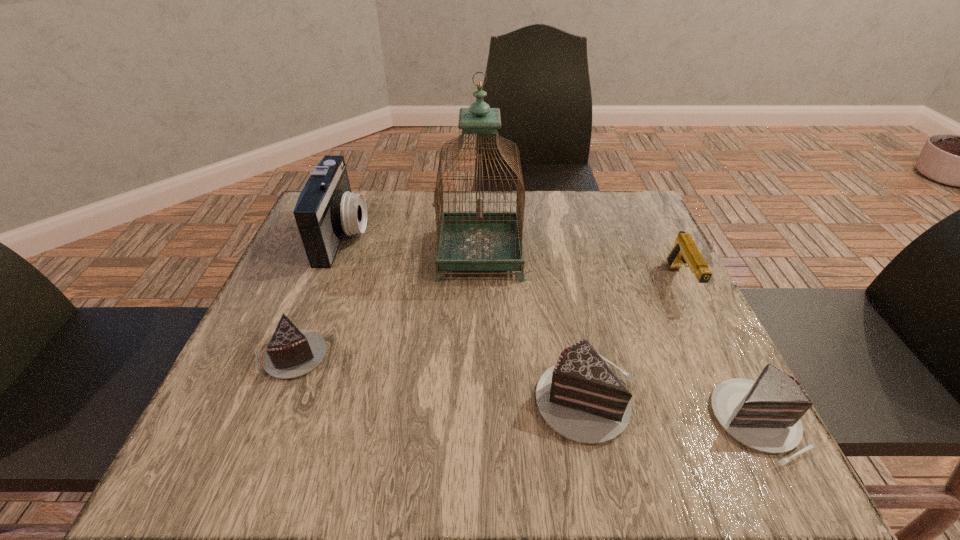
The height and width of the screenshot is (540, 960). What are the coordinates of `free space located on the left of the second shortest object` in the screenshot? It's located at (617, 422).

I want to click on free space located at the door of the birdcage, so [x=593, y=254].

At what (x,y) coordinates should I click in order to perform the action: click on vacant space located 0.260m on the lens of the camcorder. Please return your answer as a coordinate pair (x, y). Looking at the image, I should click on (470, 234).

This screenshot has width=960, height=540. I want to click on vacant point located 0.180m at the barrel of the pistol, so click(x=729, y=382).

I want to click on birdcage at the far edge, so click(x=479, y=240).

Where is `camcorder that is at the far edge`? The height and width of the screenshot is (540, 960). camcorder that is at the far edge is located at coordinates (326, 209).

The image size is (960, 540). What are the coordinates of `chocolate cake present at the left edge` in the screenshot? It's located at (291, 352).

Where is `camcorder located in the left edge section of the desktop`? camcorder located in the left edge section of the desktop is located at coordinates (326, 209).

The height and width of the screenshot is (540, 960). In order to click on chocolate cake that is at the right edge in this screenshot , I will do `click(764, 415)`.

At what (x,y) coordinates should I click in order to perform the action: click on pistol that is at the right edge. Please return your answer as a coordinate pair (x, y). The height and width of the screenshot is (540, 960). Looking at the image, I should click on (685, 252).